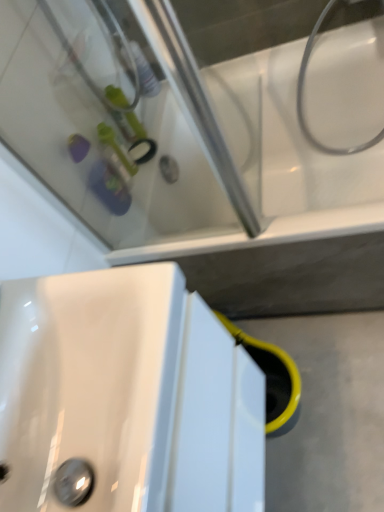
Question: Could you tell me if white glossy hose at upper right is turned towards white glossy sink at lower left?

Choices:
 (A) no
 (B) yes

Answer: (A)

Question: From the image's perspective, is white glossy hose at upper right below white glossy sink at lower left?

Choices:
 (A) no
 (B) yes

Answer: (A)

Question: Could white glossy sink at lower left be considered to be inside white glossy hose at upper right?

Choices:
 (A) no
 (B) yes

Answer: (A)

Question: Is white glossy hose at upper right smaller than white glossy sink at lower left?

Choices:
 (A) no
 (B) yes

Answer: (B)

Question: Is white glossy hose at upper right next to white glossy sink at lower left?

Choices:
 (A) yes
 (B) no

Answer: (B)

Question: Can you confirm if white glossy hose at upper right is bigger than white glossy sink at lower left?

Choices:
 (A) no
 (B) yes

Answer: (A)

Question: From the image's perspective, is white glossy sink at lower left located beneath white glossy hose at upper right?

Choices:
 (A) yes
 (B) no

Answer: (A)

Question: Is the position of white glossy sink at lower left more distant than that of white glossy hose at upper right?

Choices:
 (A) yes
 (B) no

Answer: (B)

Question: Can you confirm if white glossy sink at lower left is bigger than white glossy hose at upper right?

Choices:
 (A) no
 (B) yes

Answer: (B)

Question: Does white glossy sink at lower left have a greater height compared to white glossy hose at upper right?

Choices:
 (A) no
 (B) yes

Answer: (A)

Question: Considering the relative positions of white glossy sink at lower left and white glossy hose at upper right in the image provided, is white glossy sink at lower left in front of white glossy hose at upper right?

Choices:
 (A) yes
 (B) no

Answer: (A)

Question: From a real-world perspective, does white glossy sink at lower left stand above white glossy hose at upper right?

Choices:
 (A) no
 (B) yes

Answer: (B)

Question: From a real-world perspective, is white glossy hose at upper right beneath white glossy bathtub at upper center?

Choices:
 (A) yes
 (B) no

Answer: (B)